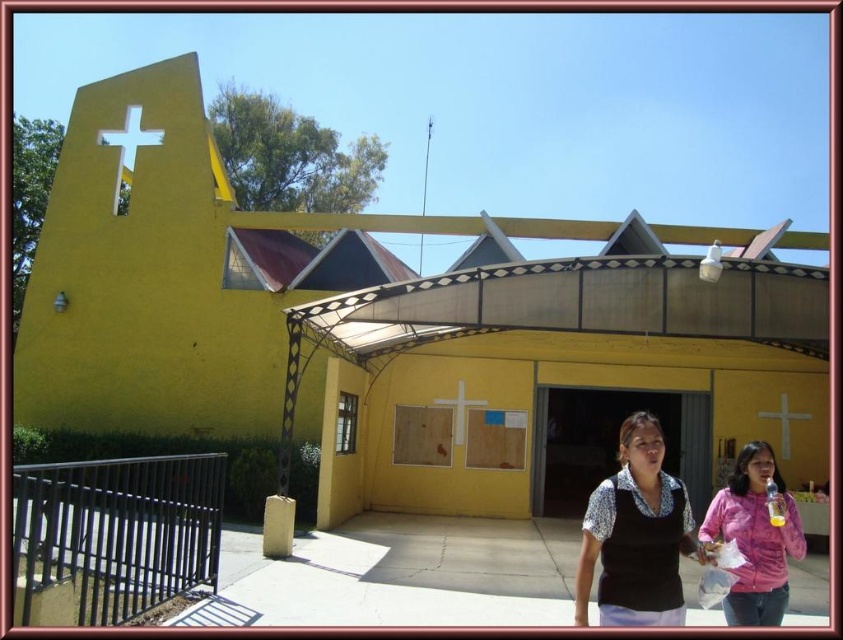
You are standing outside the church and notice two items in the scene. Which one is bigger between the pink fabric shirt at lower right and the white matte cross at upper center?

The pink fabric shirt at lower right is larger in size compared to the white matte cross at upper center.

You are standing in front of the church and want to take a photo of both the yellow matte building at center and the matte black blouse at center. Which object should you adjust your camera angle to focus on first to ensure both are in frame?

The yellow matte building at center is above the matte black blouse at center, so you should focus on the building first to ensure the blouse is also captured in the lower part of the frame.